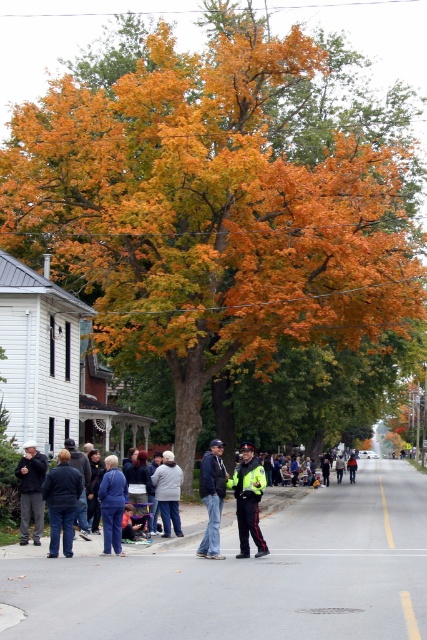
You are standing at the center of the street and see the dark gray jacket at left. Which direction should you walk to get closer to the jacket?

You should walk to the left because the dark gray jacket at left is located on the left side of the street.

You are a fashion designer observing the autumn street scene. You notice two pairs of jeans displayed on mannequins. The dark blue jeans at left and the blue denim jeans at lower left. Which pair of jeans appears taller in the image?

The dark blue jeans at left appears taller than the blue denim jeans at lower left according to the description provided.